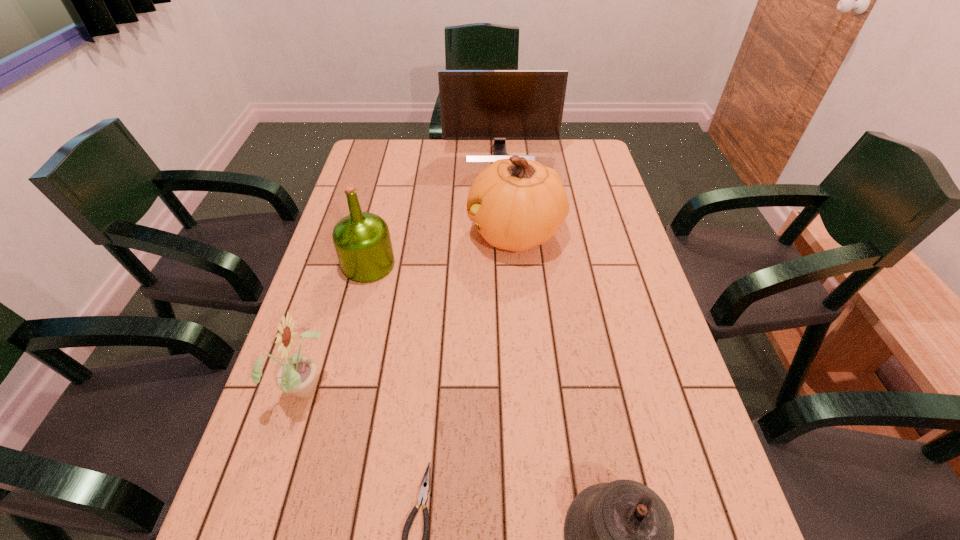
Image resolution: width=960 pixels, height=540 pixels. I want to click on monitor, so click(x=499, y=105).

In order to click on pumpkin in this screenshot , I will do `click(517, 204)`.

Identify the location of olive oil. The width and height of the screenshot is (960, 540). (362, 241).

Where is `the fourth farthest object`? The height and width of the screenshot is (540, 960). the fourth farthest object is located at coordinates (297, 375).

Locate an element on the screen. free spot located on the screen side of the monitor is located at coordinates (505, 227).

Find the location of a particular element. vacant space situated 0.270m on the front face of the pumpkin is located at coordinates (378, 233).

In order to click on vacant position located on the front face of the pumpkin in this screenshot , I will do `click(358, 233)`.

This screenshot has width=960, height=540. I want to click on vacant space located 0.380m on the front face of the pumpkin, so click(342, 233).

Locate an element on the screen. The image size is (960, 540). free space located 0.160m on the back of the olive oil is located at coordinates (381, 213).

Identify the location of blank space located on the front-facing side of the sunflower. The height and width of the screenshot is (540, 960). (425, 387).